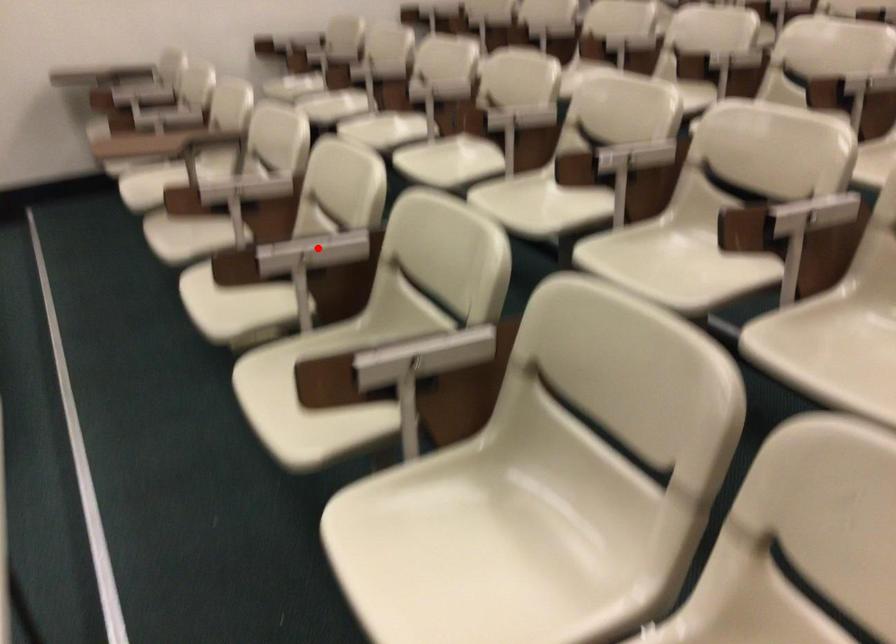
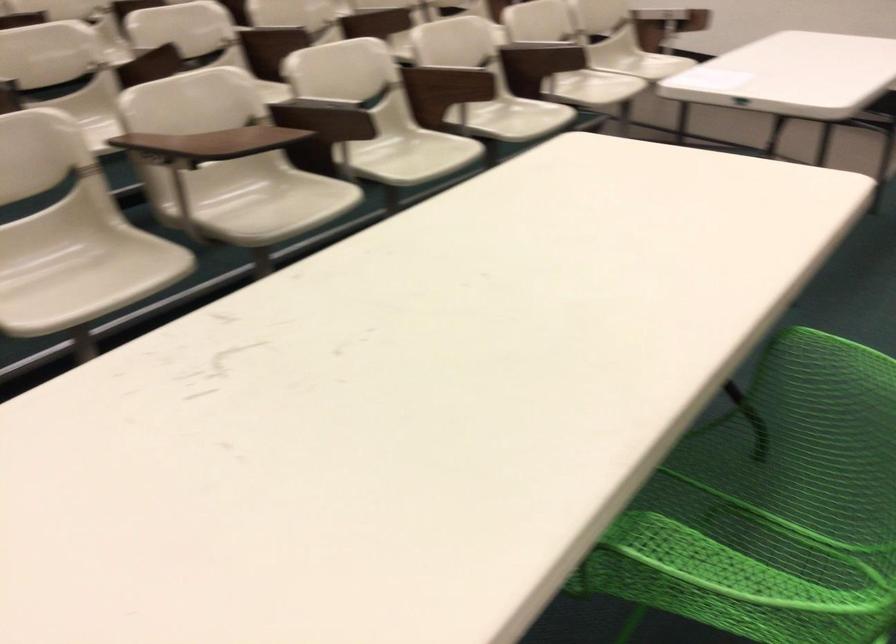
The point at the highlighted location is marked in the first image. Where is the corresponding point in the second image?

(455, 73)